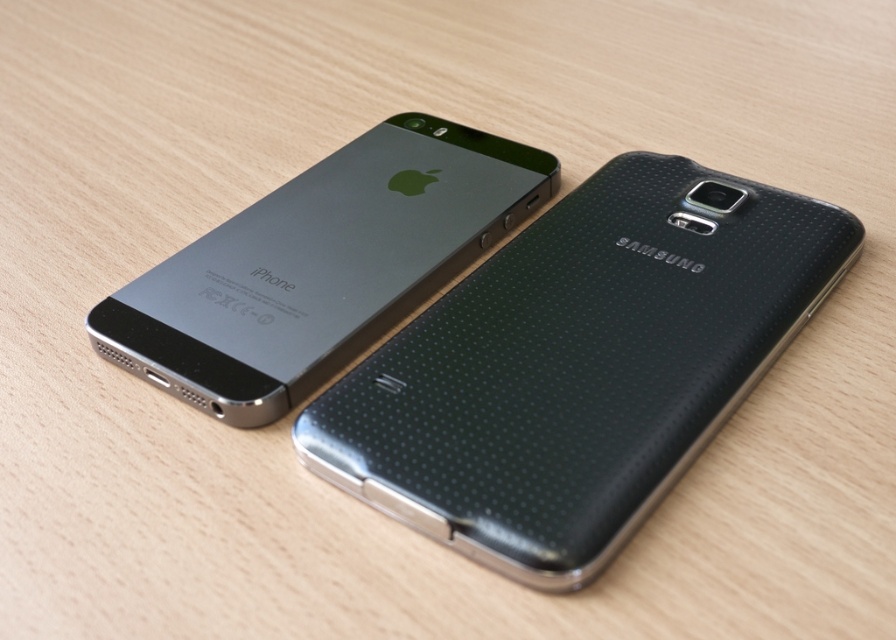
Question: Does black textured phone at center have a greater width compared to satin black iphone at upper left?

Choices:
 (A) yes
 (B) no

Answer: (A)

Question: Does black textured phone at center have a greater width compared to satin black iphone at upper left?

Choices:
 (A) yes
 (B) no

Answer: (A)

Question: Among these objects, which one is nearest to the camera?

Choices:
 (A) black textured phone at center
 (B) satin black iphone at upper left

Answer: (A)

Question: Can you confirm if black textured phone at center is positioned to the left of satin black iphone at upper left?

Choices:
 (A) no
 (B) yes

Answer: (A)